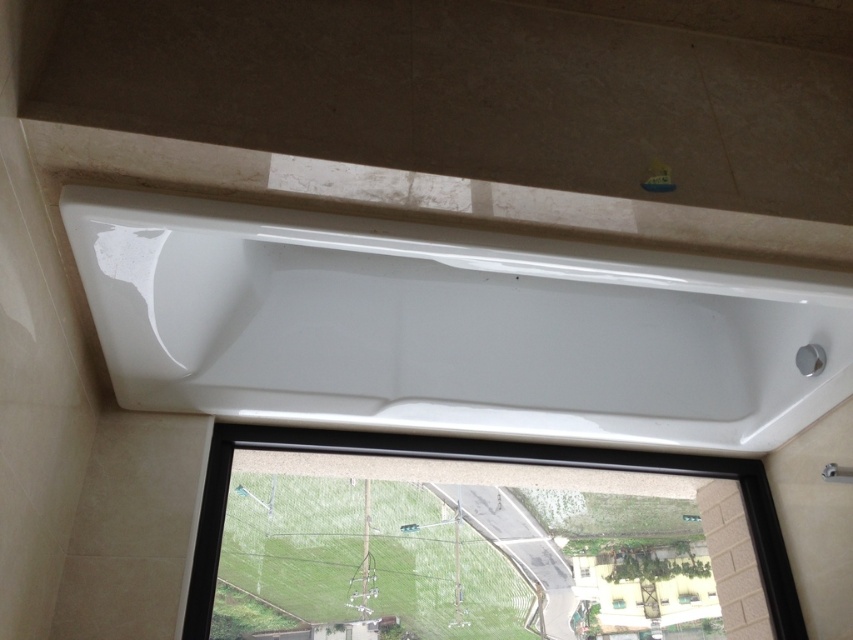
Question: From the image, what is the correct spatial relationship of transparent glass window at lower center in relation to transparent glass window at center?

Choices:
 (A) below
 (B) above

Answer: (B)

Question: Is white glossy bathtub at center positioned behind transparent glass window at center?

Choices:
 (A) yes
 (B) no

Answer: (B)

Question: Which of the following is the closest to the observer?

Choices:
 (A) white glossy bathtub at center
 (B) transparent glass window at center

Answer: (A)

Question: Among these points, which one is farthest from the camera?

Choices:
 (A) coord(381,394)
 (B) coord(616,604)
 (C) coord(659,460)

Answer: (B)

Question: In this image, where is white glossy bathtub at center located relative to transparent glass window at center?

Choices:
 (A) above
 (B) below

Answer: (A)

Question: Among these objects, which one is farthest from the camera?

Choices:
 (A) white glossy bathtub at center
 (B) transparent glass window at center
 (C) transparent glass window at lower center

Answer: (B)